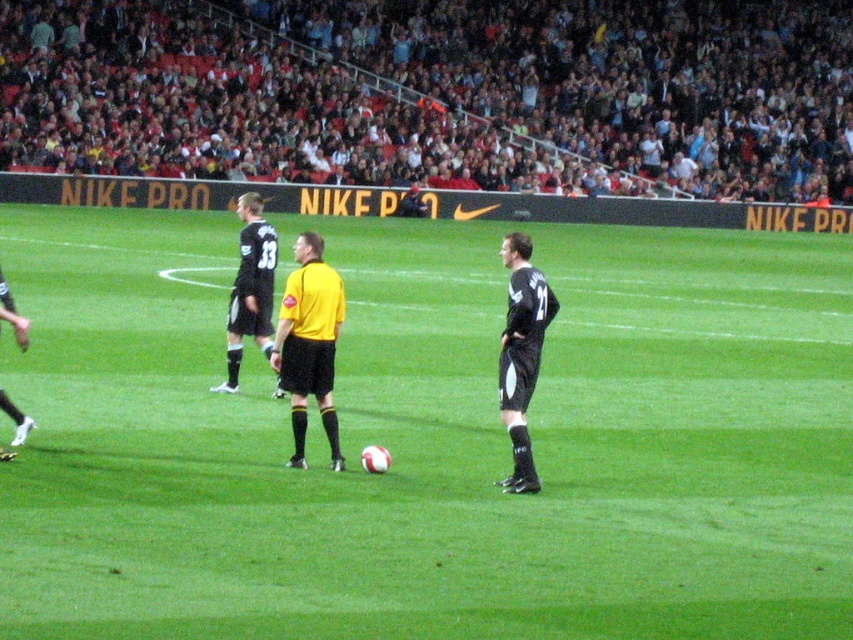
You are a soccer player positioned at the edge of the field. You see the green grass soccer ball at center and the black jersey at center. Which object is closer to your current position?

The black jersey at center is closer to your current position because the green grass soccer ball at center is to the right of it, meaning the jersey is between you and the ball.

You are standing at the edge of the soccer field and want to throw a ball to the point marked at coordinates point (259, 275). If your throwing range is 12 meters, can you reach that point?

The distance of point (259, 275) from the viewer is 12.35 meters, which exceeds your throwing range of 12 meters. Therefore, you cannot reach that point.